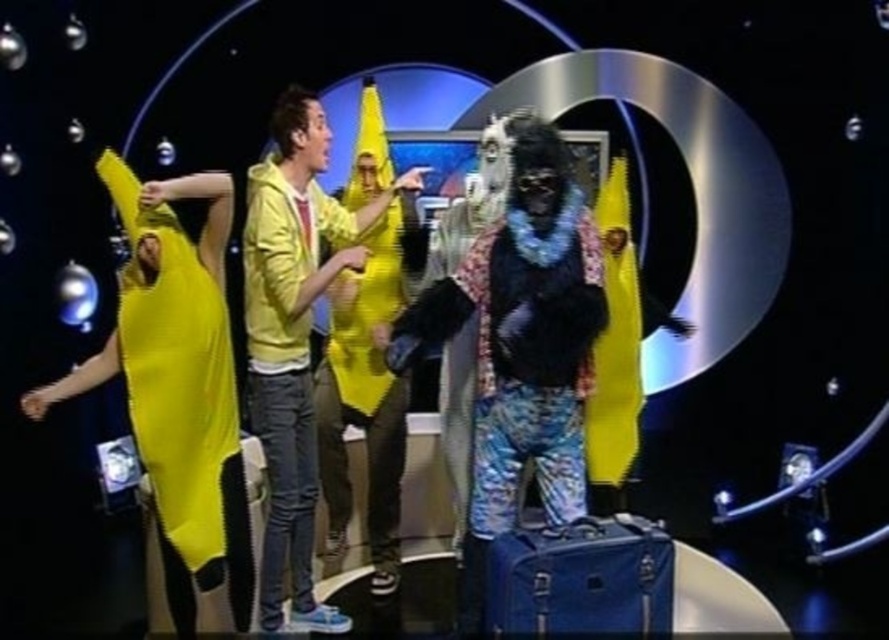
You are designing a stage layout for a space themed play and need to place two banana shaped props on the stage. The rubberized yellow banana at left and the yellow matte banana at center are both required. Considering their sizes, which banana shaped prop should be placed closer to the front of the stage to ensure visibility?

The rubberized yellow banana at left should be placed closer to the front of the stage because it occupies less space than the yellow matte banana at center, making it smaller and easier to see from the audience perspective.

You are a stagehand preparing to place a new prop on the stage. The prop requires a clear space of at least 10 feet from the front edge of the stage to avoid blocking the audience view. Given the current setup with the rubberized yellow banana at left, is the banana positioned too close to the front edge?

The rubberized yellow banana at left is positioned 8.63 feet from the viewer, which is closer than the required 10 feet. This means it is too close to the front edge and may block the audience view.